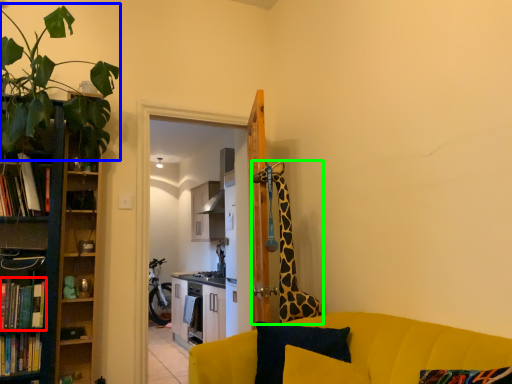
Question: Estimate the real-world distances between objects in this image. Which object is farther from book (highlighted by a red box), plant (highlighted by a blue box) or giraffe (highlighted by a green box)?

Choices:
 (A) plant
 (B) giraffe

Answer: (B)